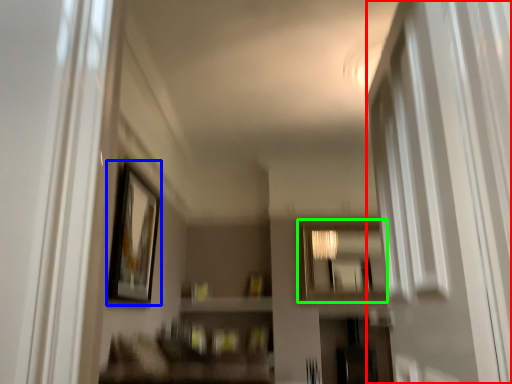
Question: Which is nearer to the screen door (highlighted by a red box)? picture frame (highlighted by a blue box) or mirror (highlighted by a green box).

Choices:
 (A) picture frame
 (B) mirror

Answer: (A)